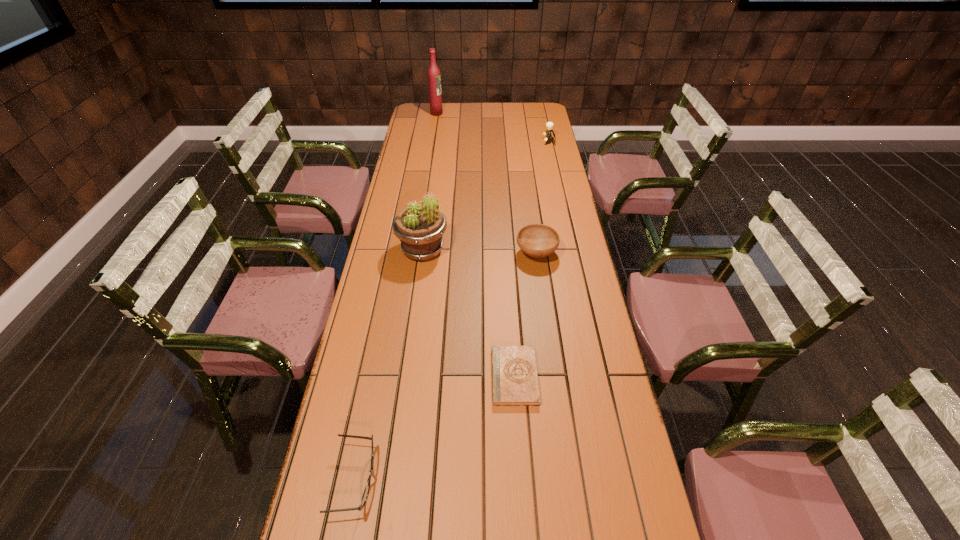
The image size is (960, 540). I want to click on vacant space located 0.220m on the label of the liquor, so click(x=484, y=113).

I want to click on free space located on the right of the flowerpot, so click(x=470, y=250).

In order to click on vacant space located on the front-facing side of the fifth nearest object in this screenshot , I will do `click(510, 142)`.

The image size is (960, 540). I want to click on vacant area located 0.200m on the front-facing side of the fifth nearest object, so point(501,142).

Where is `free location located on the front-facing side of the fifth nearest object`? This screenshot has height=540, width=960. free location located on the front-facing side of the fifth nearest object is located at coordinates (492, 142).

Where is `free space located 0.070m on the right of the third shortest object`? free space located 0.070m on the right of the third shortest object is located at coordinates [x=577, y=254].

Image resolution: width=960 pixels, height=540 pixels. In order to click on free space located on the front-facing side of the spectacles in this screenshot , I will do `click(478, 480)`.

Find the location of `free region located 0.360m on the spine side of the diary`. free region located 0.360m on the spine side of the diary is located at coordinates (362, 376).

This screenshot has width=960, height=540. I want to click on free space located on the spine side of the diary, so [470, 376].

Locate an element on the screen. This screenshot has width=960, height=540. free space located on the spine side of the diary is located at coordinates (384, 376).